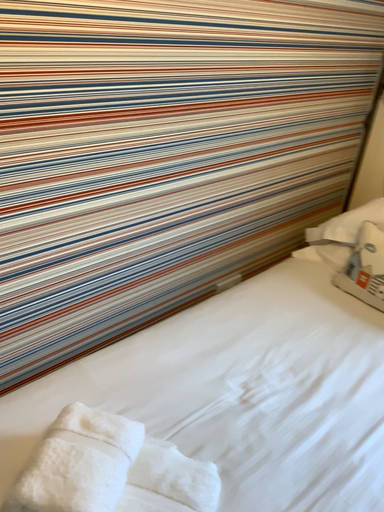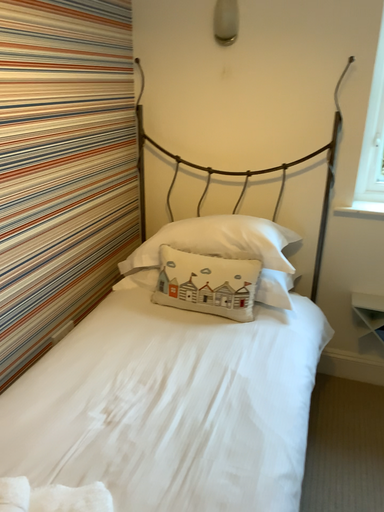
Question: Which way did the camera rotate in the video?

Choices:
 (A) rotated downward
 (B) rotated upward

Answer: (B)